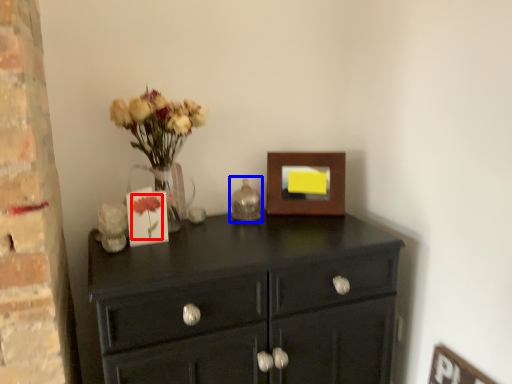
Question: Which of the following is the closest to the observer, flower (highlighted by a red box) or candle holder (highlighted by a blue box)?

Choices:
 (A) flower
 (B) candle holder

Answer: (A)